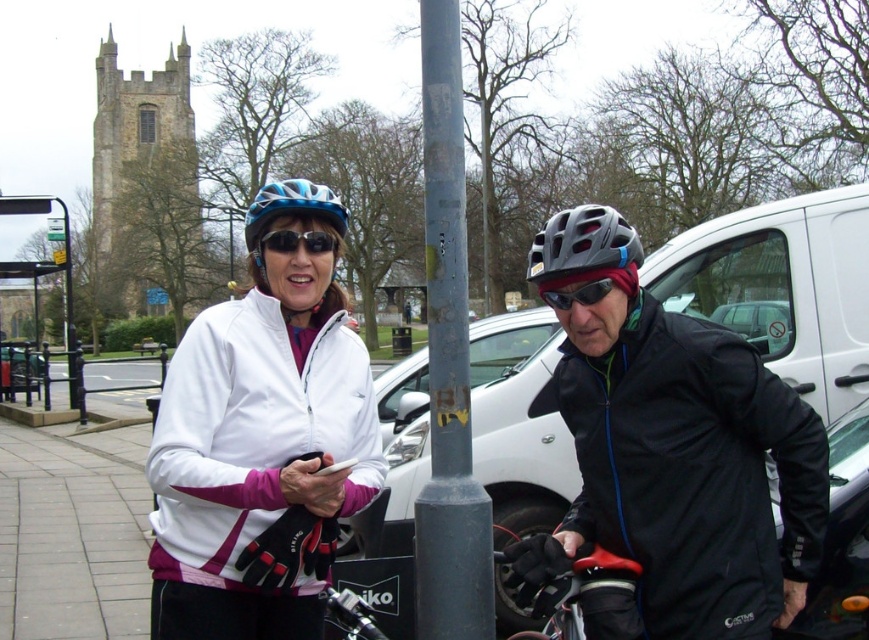
You are a delivery person who needs to attach a package to your bike. The gray metallic pole at center is in your way. Can you move the blue matte bicycle helmet at center out of the way to access the pole?

The gray metallic pole at center is not as tall as the blue matte bicycle helmet at center, so the helmet is taller. Since the pole is shorter, you can move the helmet to access the pole.

You are a photographer standing at the camera position. You want to take a closeup photo of the red rubber handlebar at lower center. The camera can focus on objects within 3 meters. Can you take the photo without moving closer?

The red rubber handlebar at lower center is 3.31 meters away from camera. Since the camera can focus within 3 meters, the handlebar is slightly out of range. You need to move closer to take the closeup photo.